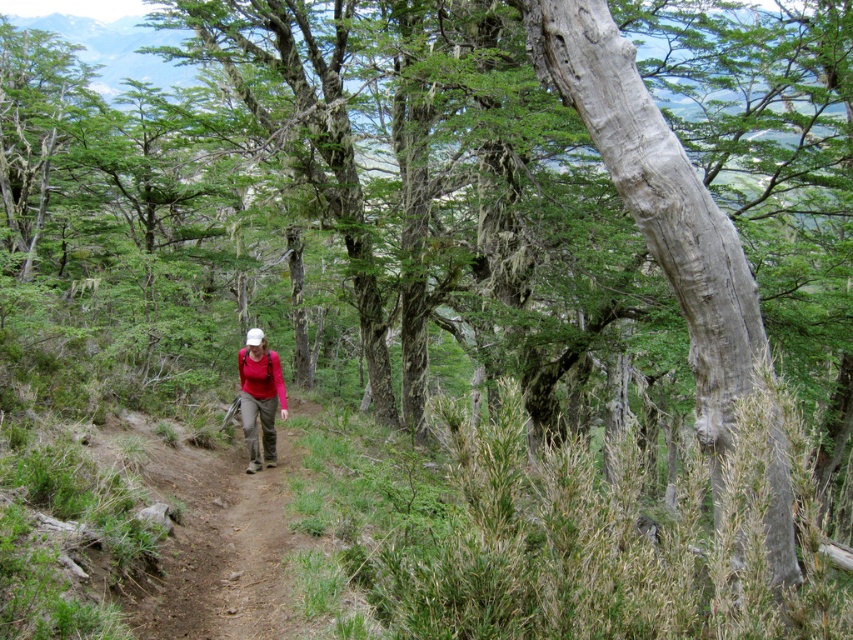
You are a hiker wearing a matte red shirt at center and standing on a brown dirt trail at center. You want to move to the right side of the trail to avoid a muddy section. Which direction should you move relative to your current position?

The brown dirt trail at center is positioned on the left side of the matte red shirt at center, so to move to the right side of the trail, you should shift your position to the right relative to your current location on the trail.

You are a hiker trying to follow the path in the forest. The scene shows a brown dirt trail at center and a matte red shirt at center. Which object takes up more space in the image?

The brown dirt trail at center is bigger than matte red shirt at center, so the brown dirt trail at center takes up more space in the image.